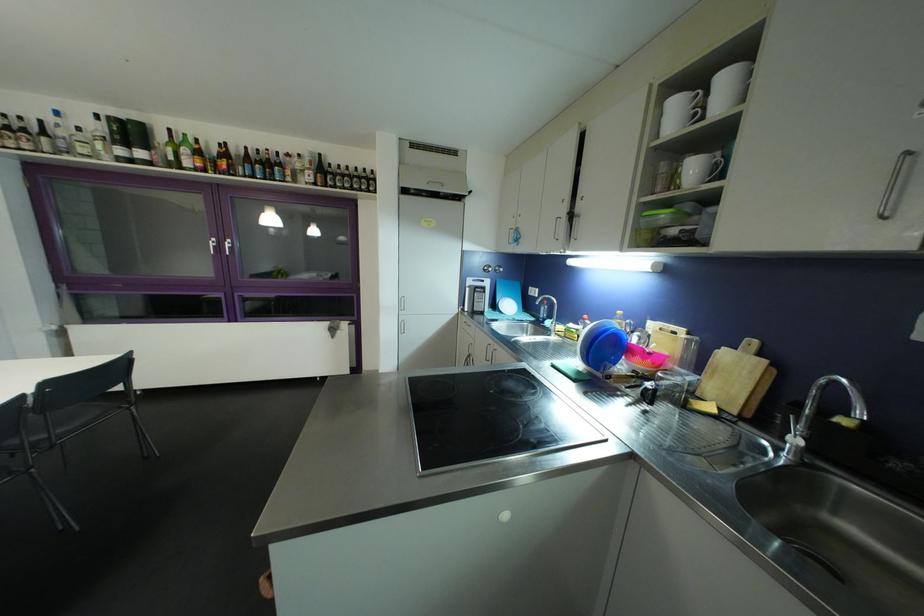
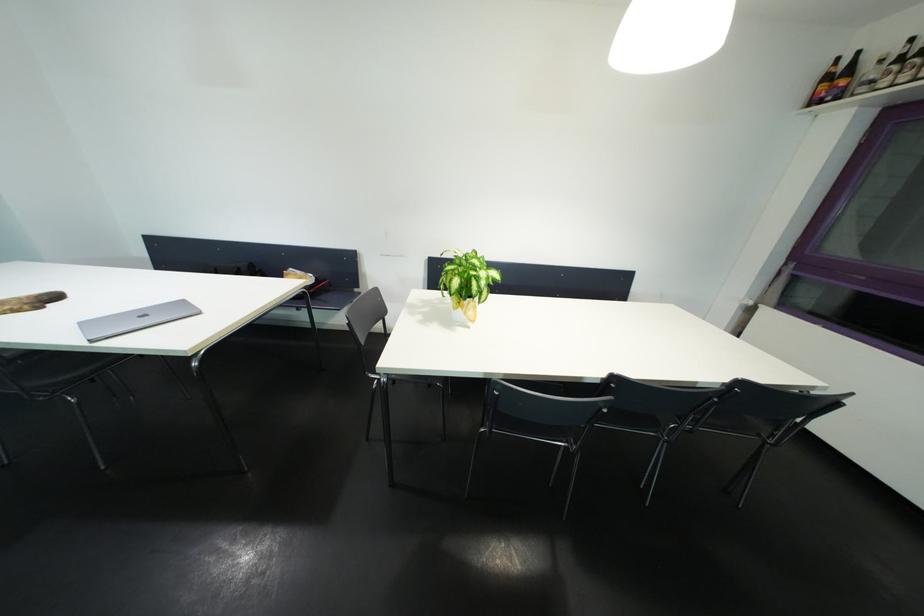
Looking at this image, how did the camera likely rotate?

The camera's rotation is toward left-down.